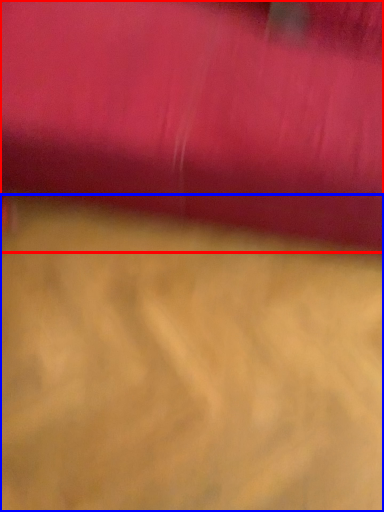
Question: Which object appears closest to the camera in this image, curtain (highlighted by a red box) or surface (highlighted by a blue box)?

Choices:
 (A) curtain
 (B) surface

Answer: (A)